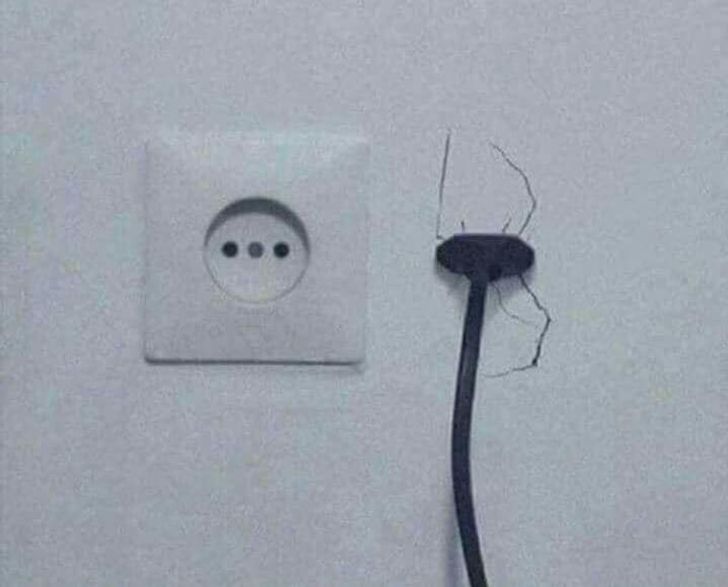
At what (x,y) coordinates should I click in order to perform the action: click on largest crack in wall. Please return your answer as a coordinate pair (x, y). The height and width of the screenshot is (587, 728). Looking at the image, I should click on (547, 329).